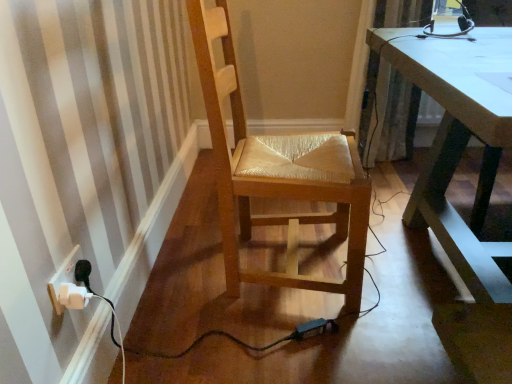
This screenshot has width=512, height=384. What do you see at coordinates (389, 114) in the screenshot?
I see `textured beige curtain at upper right` at bounding box center [389, 114].

What are the coordinates of `wooden woven seat at center` in the screenshot? It's located at (277, 173).

Locate an element on the screen. curtain on the right of white plastic plug at lower left is located at coordinates (389, 114).

Can you confirm if textured beige curtain at upper right is smaller than white plastic plug at lower left?

No.

Consider the image. From a real-world perspective, relative to white plastic plug at lower left, is textured beige curtain at upper right vertically above or below?

From a real-world perspective, textured beige curtain at upper right is physically above white plastic plug at lower left.

In the scene shown: Is textured beige curtain at upper right wider or thinner than white plastic plug at lower left?

textured beige curtain at upper right is wider than white plastic plug at lower left.

Can you confirm if white plastic plug at lower left is taller than wooden woven seat at center?

No, white plastic plug at lower left is not taller than wooden woven seat at center.

Could you tell me if white plastic plug at lower left is facing wooden woven seat at center?

No, white plastic plug at lower left is not turned towards wooden woven seat at center.

Is white plastic plug at lower left wider than wooden woven seat at center?

In fact, white plastic plug at lower left might be narrower than wooden woven seat at center.

Is point (67, 275) closer to viewer compared to point (322, 280)?

That is True.

Is point (204, 30) positioned before point (66, 278)?

No, it is not.

From a real-world perspective, does wooden woven seat at center sit lower than white plastic plug at lower left?

Actually, wooden woven seat at center is physically above white plastic plug at lower left in the real world.

Is wooden woven seat at center at the right side of white plastic plug at lower left?

Yes, wooden woven seat at center is to the right of white plastic plug at lower left.

From the image's perspective, is wooden woven seat at center above white plastic plug at lower left?

Indeed, from the image's perspective, wooden woven seat at center is shown above white plastic plug at lower left.

In the image, is wooden woven seat at center positioned in front of or behind textured beige curtain at upper right?

In the image, wooden woven seat at center appears in front of textured beige curtain at upper right.

Can you confirm if wooden woven seat at center is taller than textured beige curtain at upper right?

Yes, wooden woven seat at center is taller than textured beige curtain at upper right.

How many degrees apart are the facing directions of textured beige curtain at upper right and wooden woven seat at center?

textured beige curtain at upper right and wooden woven seat at center are facing 78.2 degrees away from each other.

Can you confirm if textured beige curtain at upper right is shorter than wooden woven seat at center?

Yes.

Find the location of a particular element. curtain behind the wooden woven seat at center is located at coordinates (389, 114).

Considering their positions, is textured beige curtain at upper right located in front of or behind wooden woven seat at center?

textured beige curtain at upper right is behind wooden woven seat at center.

Locate an element on the screen. The image size is (512, 384). electric outlet below the textured beige curtain at upper right (from a real-world perspective) is located at coordinates (63, 277).

Could you tell me if white plastic plug at lower left is turned towards textured beige curtain at upper right?

No, white plastic plug at lower left is not oriented towards textured beige curtain at upper right.

Can you confirm if white plastic plug at lower left is smaller than textured beige curtain at upper right?

Yes.

Where is `curtain that appears on the right of white plastic plug at lower left`? The width and height of the screenshot is (512, 384). curtain that appears on the right of white plastic plug at lower left is located at coordinates (389, 114).

I want to click on electric outlet located below the wooden woven seat at center (from the image's perspective), so click(63, 277).

Estimate the real-world distances between objects in this image. Which object is further from white plastic plug at lower left, textured beige curtain at upper right or wooden woven seat at center?

The object further to white plastic plug at lower left is textured beige curtain at upper right.

Which object lies further to the anchor point wooden woven seat at center, textured beige curtain at upper right or white plastic plug at lower left?

textured beige curtain at upper right.

When comparing their distances from textured beige curtain at upper right, does wooden woven seat at center or white plastic plug at lower left seem closer?

Based on the image, wooden woven seat at center appears to be nearer to textured beige curtain at upper right.

Which object lies further to the anchor point textured beige curtain at upper right, white plastic plug at lower left or wooden woven seat at center?

The object further to textured beige curtain at upper right is white plastic plug at lower left.

Considering their positions, is wooden woven seat at center positioned closer to white plastic plug at lower left than textured beige curtain at upper right?

wooden woven seat at center is positioned closer to the anchor white plastic plug at lower left.

Looking at the image, which one is located further to wooden woven seat at center, white plastic plug at lower left or textured beige curtain at upper right?

textured beige curtain at upper right is further to wooden woven seat at center.

Locate an element on the screen. This screenshot has height=384, width=512. chair between white plastic plug at lower left and textured beige curtain at upper right from front to back is located at coordinates (277, 173).